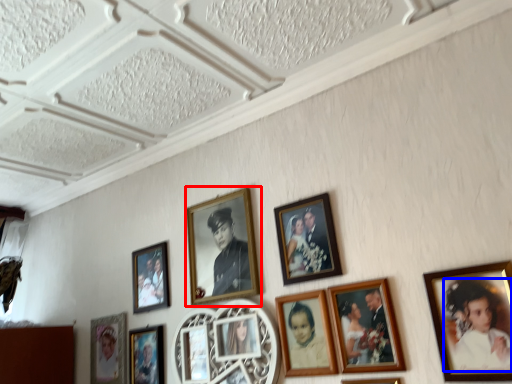
Question: Which of the following is the farthest to the observer, picture frame (highlighted by a red box) or person (highlighted by a blue box)?

Choices:
 (A) picture frame
 (B) person

Answer: (A)